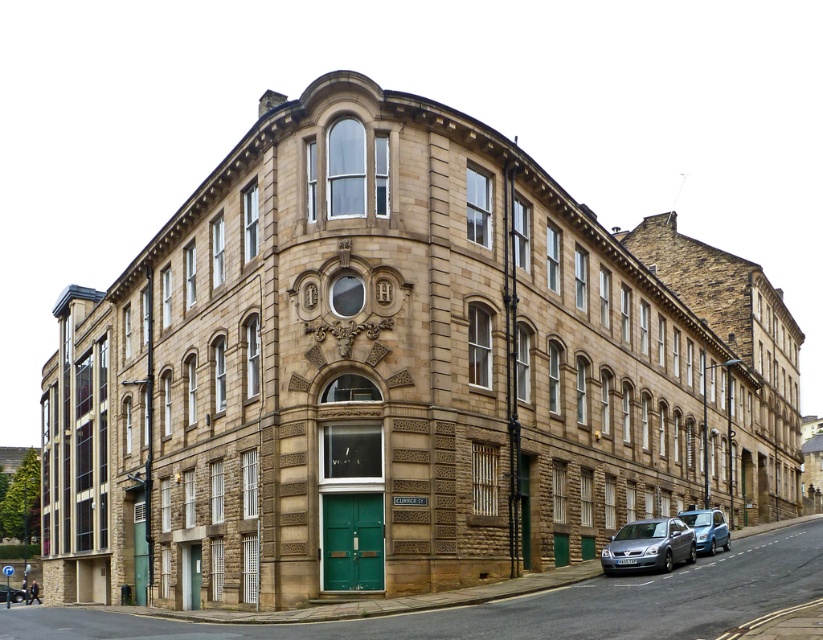
You are standing at the corner of the building and want to park your car. The parking spot is at point (649, 545). What color is the car currently occupying that spot?

The car currently occupying the parking spot at point (649, 545) is silver metallic.

You are a delivery person trying to park a van that is 2 meters wide. You see the silver metallic car at lower right and the metallic blue car at lower right. Can you fit your van between them?

The silver metallic car at lower right is thinner than metallic blue car at lower right. The space between them would depend on their positioning, but since the silver car is thinner, there might be enough space. However, without knowing the exact distance between the cars, it is uncertain if the van can fit. Please check the actual space available.